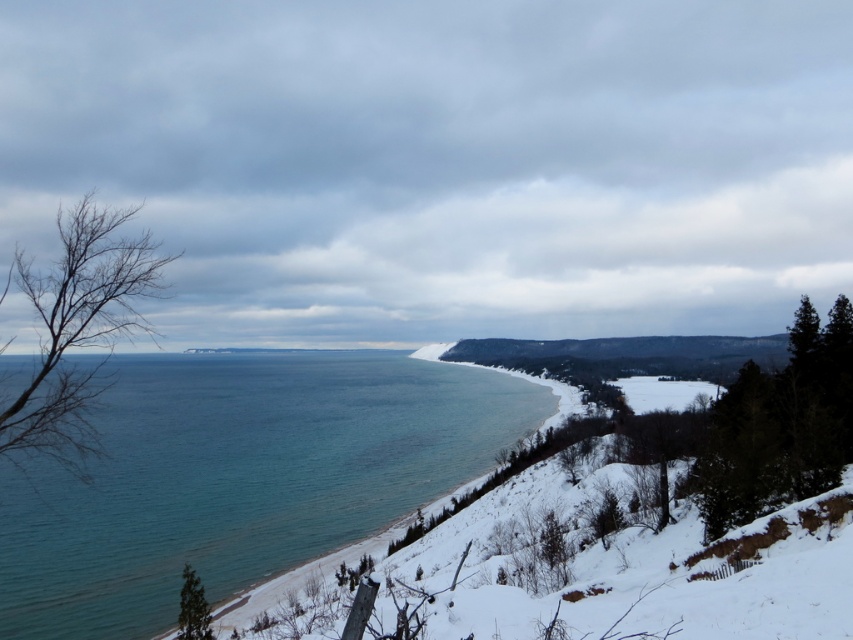
You are standing on the snowy slope and want to reach the clear blue water at center. Which direction should you walk relative to the dark green evergreen at right?

You should walk downward towards the clear blue water at center, which is located below the dark green evergreen at right.

You are standing on the snowy slope and want to take a photo of the bare branches at left and the green matte tree at lower left. Which object will appear closer to the camera in the photo?

The bare branches at left will appear closer to the camera because it is in front of the green matte tree at lower left.